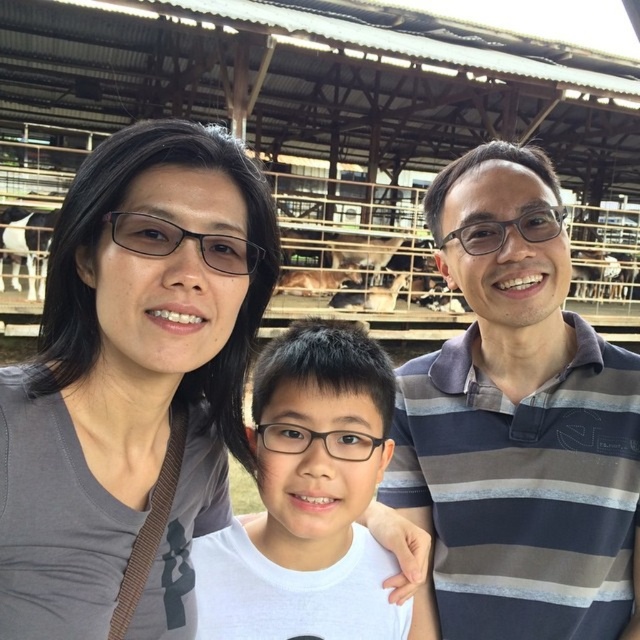
You are a photographer trying to adjust the camera focus. The gray matte shirt at upper left and the striped cotton polo shirt at right are in the frame. Which shirt should you focus on first if you want to ensure both are in focus, considering their positions?

The gray matte shirt at upper left is much taller than the striped cotton polo shirt at right, so focusing on the gray matte shirt at upper left first would help ensure both are in focus as it is the farther one.

You are a photographer trying to arrange the family members for a group photo. You want to place the striped cotton polo shirt at right and the white matte shirt at center so that they are at the same height. What adjustment should you make based on their current positions?

The striped cotton polo shirt at right is much taller than the white matte shirt at center, so you should lower the striped cotton polo shirt at right or raise the white matte shirt at center to make them the same height.